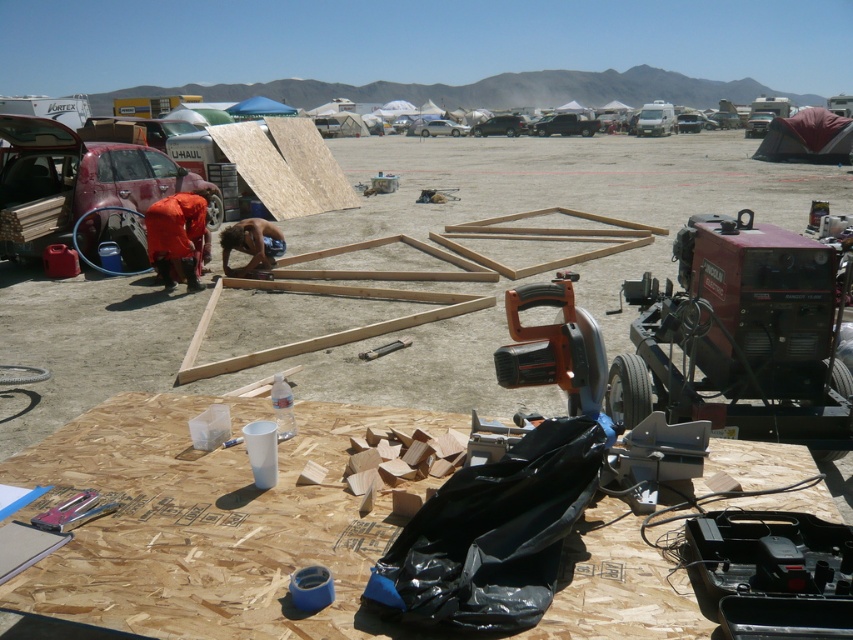
Question: Does matte red car at left appear on the right side of black matte truck at center?

Choices:
 (A) yes
 (B) no

Answer: (B)

Question: Which of these objects is positioned closest to the black matte car at center?

Choices:
 (A) metallic silver tool at center
 (B) black matte truck at center
 (C) pink plastic stapler at lower left
 (D) matte red car at left

Answer: (B)

Question: Among these objects, which one is farthest from the camera?

Choices:
 (A) brown osb board at center
 (B) red cotton shirt at lower left
 (C) black matte truck at center

Answer: (C)

Question: Which object appears closest to the camera in this image?

Choices:
 (A) silver metallic car at center
 (B) pink plastic stapler at lower left

Answer: (B)

Question: Is matte red car at left to the right of black matte car at center from the viewer's perspective?

Choices:
 (A) yes
 (B) no

Answer: (B)

Question: Is red cotton shirt at lower left thinner than naked wood at center?

Choices:
 (A) yes
 (B) no

Answer: (A)